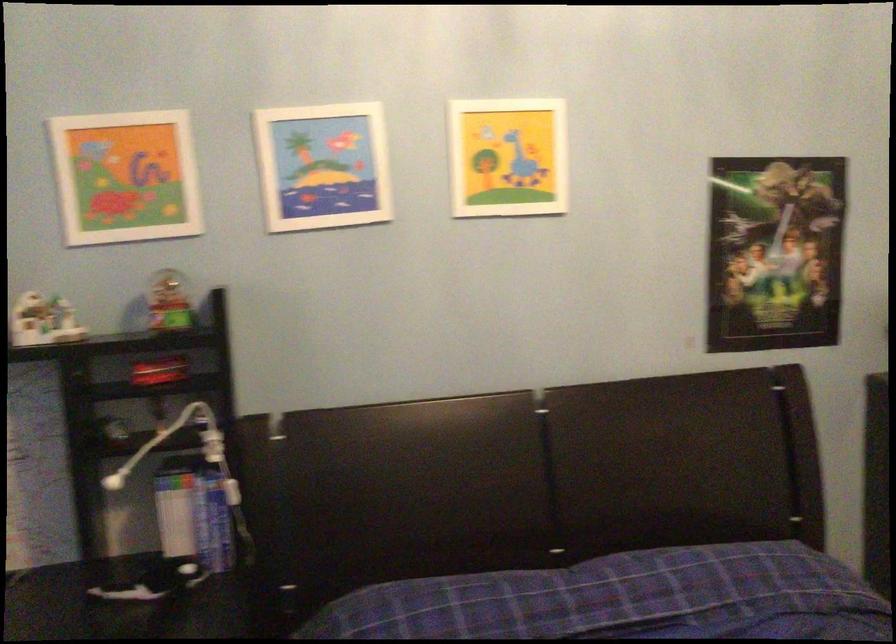
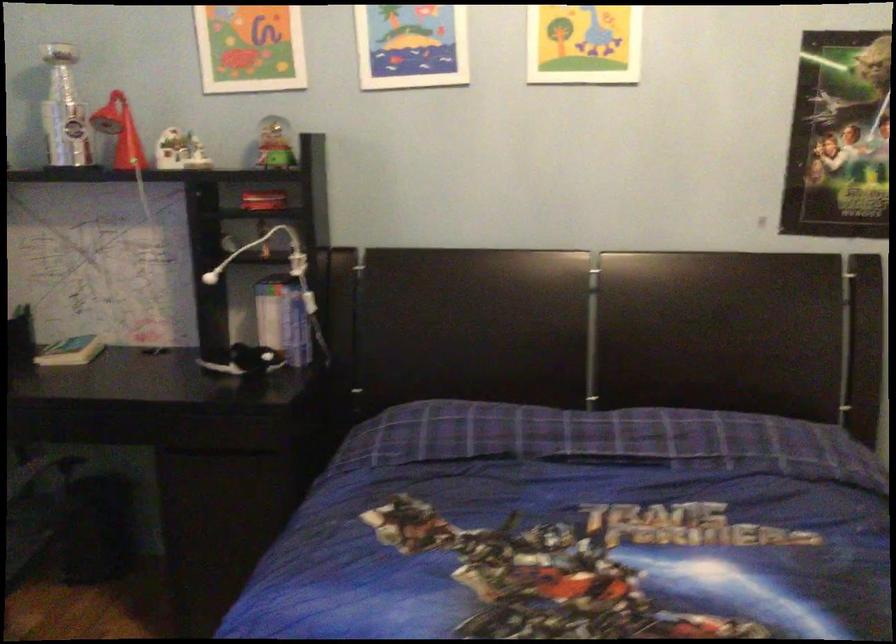
The point at (204,520) is marked in the first image. Where is the corresponding point in the second image?

(288, 321)